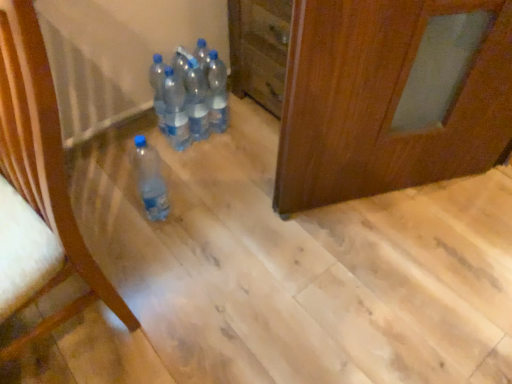
Measure the distance between transparent plastic bottles at center, the 5th bottle when ordered from right to left, and camera.

transparent plastic bottles at center, the 5th bottle when ordered from right to left, is 4.58 feet from camera.

Identify the location of transparent plastic bottles at center, the 5th bottle when ordered from right to left. point(158,88).

Identify the location of transparent plastic bottles at center, placed as the 5th bottle when sorted from left to right. coord(216,92).

The height and width of the screenshot is (384, 512). Describe the element at coordinates (41, 178) in the screenshot. I see `clear plastic bottle at left` at that location.

The image size is (512, 384). What are the coordinates of `translucent plastic bottle at lower left, marked as the 2th bottle in a left-to-right arrangement` in the screenshot? It's located at (150, 180).

Image resolution: width=512 pixels, height=384 pixels. Describe the element at coordinates (196, 101) in the screenshot. I see `translucent plastic bottles at center, placed as the fourth bottle when sorted from left to right` at that location.

I want to click on transparent plastic bottles at center, which appears as the 1th bottle when viewed from the left, so click(x=158, y=88).

Considering the relative sizes of translucent plastic bottle at lower left, acting as the 4th bottle starting from the right, and clear plastic bottle at left in the image provided, is translucent plastic bottle at lower left, acting as the 4th bottle starting from the right, shorter than clear plastic bottle at left?

Yes, translucent plastic bottle at lower left, acting as the 4th bottle starting from the right, is shorter than clear plastic bottle at left.

From a real-world perspective, who is located higher, translucent plastic bottle at lower left, acting as the 4th bottle starting from the right, or clear plastic bottle at left?

From a 3D spatial view, clear plastic bottle at left is above.

Is translucent plastic bottle at lower left, acting as the 4th bottle starting from the right, facing away from clear plastic bottle at left?

No, clear plastic bottle at left is not at the back of translucent plastic bottle at lower left, acting as the 4th bottle starting from the right.

Find the location of a particular element. furniture to the left of translucent plastic bottle at lower left, acting as the 4th bottle starting from the right is located at coordinates (41, 178).

Is translucent plastic bottle at lower left, acting as the 4th bottle starting from the right, smaller than transparent plastic bottles at center, the 3th bottle in the right-to-left sequence?

No, translucent plastic bottle at lower left, acting as the 4th bottle starting from the right, is not smaller than transparent plastic bottles at center, the 3th bottle in the right-to-left sequence.

Is translucent plastic bottle at lower left, marked as the 2th bottle in a left-to-right arrangement, to the left of transparent plastic bottles at center, the third bottle positioned from the left, from the viewer's perspective?

Correct, you'll find translucent plastic bottle at lower left, marked as the 2th bottle in a left-to-right arrangement, to the left of transparent plastic bottles at center, the third bottle positioned from the left.

From a real-world perspective, is translucent plastic bottle at lower left, marked as the 2th bottle in a left-to-right arrangement, below transparent plastic bottles at center, the 3th bottle in the right-to-left sequence?

Correct, in the physical world, translucent plastic bottle at lower left, marked as the 2th bottle in a left-to-right arrangement, is lower than transparent plastic bottles at center, the 3th bottle in the right-to-left sequence.

Between point (153, 202) and point (166, 126), which one is positioned in front?

The point (153, 202) is closer.

In the scene shown: What's the angular difference between translucent plastic bottle at lower left, marked as the 2th bottle in a left-to-right arrangement, and transparent plastic bottles at center, the 5th bottle when ordered from right to left,'s facing directions?

There is a 0.00146-degree angle between the facing directions of translucent plastic bottle at lower left, marked as the 2th bottle in a left-to-right arrangement, and transparent plastic bottles at center, the 5th bottle when ordered from right to left.

Consider the image. Looking at their sizes, would you say translucent plastic bottle at lower left, marked as the 2th bottle in a left-to-right arrangement, is wider or thinner than transparent plastic bottles at center, which appears as the 1th bottle when viewed from the left?

Considering their sizes, translucent plastic bottle at lower left, marked as the 2th bottle in a left-to-right arrangement, looks broader than transparent plastic bottles at center, which appears as the 1th bottle when viewed from the left.

Is translucent plastic bottle at lower left, marked as the 2th bottle in a left-to-right arrangement, to the left or to the right of transparent plastic bottles at center, which appears as the 1th bottle when viewed from the left, in the image?

In the image, translucent plastic bottle at lower left, marked as the 2th bottle in a left-to-right arrangement, appears on the right side of transparent plastic bottles at center, which appears as the 1th bottle when viewed from the left.

From the image's perspective, is translucent plastic bottle at lower left, acting as the 4th bottle starting from the right, below transparent plastic bottles at center, which appears as the 1th bottle when viewed from the left?

Correct, translucent plastic bottle at lower left, acting as the 4th bottle starting from the right, appears lower than transparent plastic bottles at center, which appears as the 1th bottle when viewed from the left, in the image.

Between clear plastic bottle at left and translucent plastic bottles at center, placed as the 2th bottle when sorted from right to left, which one has larger size?

Bigger between the two is clear plastic bottle at left.

Could you measure the distance between clear plastic bottle at left and translucent plastic bottles at center, placed as the 2th bottle when sorted from right to left?

clear plastic bottle at left and translucent plastic bottles at center, placed as the 2th bottle when sorted from right to left, are 31.72 inches apart from each other.

Is clear plastic bottle at left oriented towards translucent plastic bottles at center, placed as the fourth bottle when sorted from left to right?

No, clear plastic bottle at left is not turned towards translucent plastic bottles at center, placed as the fourth bottle when sorted from left to right.

How different are the orientations of clear plastic bottle at left and translucent plastic bottles at center, placed as the fourth bottle when sorted from left to right, in degrees?

There is a 83.1-degree angle between the facing directions of clear plastic bottle at left and translucent plastic bottles at center, placed as the fourth bottle when sorted from left to right.

From a real-world perspective, is translucent plastic bottles at center, placed as the fourth bottle when sorted from left to right, located beneath transparent plastic bottles at center, the third bottle positioned from the left?

No, from a real-world perspective, translucent plastic bottles at center, placed as the fourth bottle when sorted from left to right, is not beneath transparent plastic bottles at center, the third bottle positioned from the left.

Is translucent plastic bottles at center, placed as the fourth bottle when sorted from left to right, next to transparent plastic bottles at center, the third bottle positioned from the left, and touching it?

Yes, translucent plastic bottles at center, placed as the fourth bottle when sorted from left to right, is touching transparent plastic bottles at center, the third bottle positioned from the left.

What's the angular difference between translucent plastic bottles at center, placed as the 2th bottle when sorted from right to left, and transparent plastic bottles at center, the 3th bottle in the right-to-left sequence,'s facing directions?

The facing directions of translucent plastic bottles at center, placed as the 2th bottle when sorted from right to left, and transparent plastic bottles at center, the 3th bottle in the right-to-left sequence, are 0.00225 degrees apart.

Considering the sizes of translucent plastic bottles at center, placed as the 2th bottle when sorted from right to left, and transparent plastic bottles at center, the 3th bottle in the right-to-left sequence, in the image, is translucent plastic bottles at center, placed as the 2th bottle when sorted from right to left, wider or thinner than transparent plastic bottles at center, the 3th bottle in the right-to-left sequence,?

Considering their sizes, translucent plastic bottles at center, placed as the 2th bottle when sorted from right to left, looks slimmer than transparent plastic bottles at center, the 3th bottle in the right-to-left sequence.

The width and height of the screenshot is (512, 384). In order to click on the 4th bottle directly above the translucent plastic bottle at lower left, acting as the 4th bottle starting from the right (from a real-world perspective) in this screenshot , I will do `click(196, 101)`.

From a real-world perspective, which is physically above, translucent plastic bottles at center, placed as the fourth bottle when sorted from left to right, or translucent plastic bottle at lower left, acting as the 4th bottle starting from the right?

translucent plastic bottles at center, placed as the fourth bottle when sorted from left to right, is physically above.

Considering their positions, is translucent plastic bottles at center, placed as the 2th bottle when sorted from right to left, located in front of or behind translucent plastic bottle at lower left, marked as the 2th bottle in a left-to-right arrangement?

Visually, translucent plastic bottles at center, placed as the 2th bottle when sorted from right to left, is located behind translucent plastic bottle at lower left, marked as the 2th bottle in a left-to-right arrangement.

Is clear plastic bottle at left facing away from transparent plastic bottles at center, which appears as the 1th bottle when viewed from the left?

No.

Considering the sizes of objects clear plastic bottle at left and transparent plastic bottles at center, the 5th bottle when ordered from right to left, in the image provided, who is taller, clear plastic bottle at left or transparent plastic bottles at center, the 5th bottle when ordered from right to left,?

clear plastic bottle at left is taller.

From the image's perspective, is clear plastic bottle at left above or below transparent plastic bottles at center, the 5th bottle when ordered from right to left?

Based on their image positions, clear plastic bottle at left is located beneath transparent plastic bottles at center, the 5th bottle when ordered from right to left.

Can we say clear plastic bottle at left lies outside transparent plastic bottles at center, which appears as the 1th bottle when viewed from the left?

Absolutely, clear plastic bottle at left is external to transparent plastic bottles at center, which appears as the 1th bottle when viewed from the left.

This screenshot has width=512, height=384. What are the coordinates of `the 1st bottle above the clear plastic bottle at left (from the image's perspective)` in the screenshot? It's located at (150, 180).

Which bottle is the 1st one when counting from the left side of the transparent plastic bottles at center, the 3th bottle in the right-to-left sequence? Please provide its 2D coordinates.

[(150, 180)]

When comparing their distances from translucent plastic bottle at lower left, marked as the 2th bottle in a left-to-right arrangement, does translucent plastic bottles at center, placed as the fourth bottle when sorted from left to right, or transparent plastic bottles at center, the first bottle positioned from the right, seem closer?

translucent plastic bottles at center, placed as the fourth bottle when sorted from left to right, is positioned closer to the anchor translucent plastic bottle at lower left, marked as the 2th bottle in a left-to-right arrangement.

Looking at the image, which one is located further to clear plastic bottle at left, transparent plastic bottles at center, the third bottle positioned from the left, or transparent plastic bottles at center, which appears as the 1th bottle when viewed from the left?

transparent plastic bottles at center, which appears as the 1th bottle when viewed from the left, is positioned further to the anchor clear plastic bottle at left.

From the image, which object appears to be farther from translucent plastic bottle at lower left, marked as the 2th bottle in a left-to-right arrangement, transparent plastic bottles at center, which appears as the 1th bottle when viewed from the left, or translucent plastic bottles at center, placed as the 2th bottle when sorted from right to left?

translucent plastic bottles at center, placed as the 2th bottle when sorted from right to left.

Which object lies further to the anchor point transparent plastic bottles at center, the third bottle positioned from the left, clear plastic bottle at left or transparent plastic bottles at center, which appears as the 1th bottle when viewed from the left?

clear plastic bottle at left.

In the scene shown: Looking at the image, which one is located further to clear plastic bottle at left, transparent plastic bottles at center, the third bottle positioned from the left, or translucent plastic bottles at center, placed as the fourth bottle when sorted from left to right?

Based on the image, translucent plastic bottles at center, placed as the fourth bottle when sorted from left to right, appears to be further to clear plastic bottle at left.

Estimate the real-world distances between objects in this image. Which object is closer to translucent plastic bottles at center, placed as the fourth bottle when sorted from left to right, clear plastic bottle at left or transparent plastic bottles at center, placed as the 5th bottle when sorted from left to right?

Among the two, transparent plastic bottles at center, placed as the 5th bottle when sorted from left to right, is located nearer to translucent plastic bottles at center, placed as the fourth bottle when sorted from left to right.

Looking at the image, which one is located further to transparent plastic bottles at center, the third bottle positioned from the left, translucent plastic bottles at center, placed as the fourth bottle when sorted from left to right, or translucent plastic bottle at lower left, marked as the 2th bottle in a left-to-right arrangement?

translucent plastic bottle at lower left, marked as the 2th bottle in a left-to-right arrangement, lies further to transparent plastic bottles at center, the third bottle positioned from the left, than the other object.

From the image, which object appears to be nearer to translucent plastic bottles at center, placed as the 2th bottle when sorted from right to left, translucent plastic bottle at lower left, marked as the 2th bottle in a left-to-right arrangement, or clear plastic bottle at left?

translucent plastic bottle at lower left, marked as the 2th bottle in a left-to-right arrangement, is positioned closer to the anchor translucent plastic bottles at center, placed as the 2th bottle when sorted from right to left.

In order to click on bottle between clear plastic bottle at left and transparent plastic bottles at center, the third bottle positioned from the left, from front to back in this screenshot , I will do `click(150, 180)`.

This screenshot has height=384, width=512. I want to click on bottle between translucent plastic bottles at center, placed as the fourth bottle when sorted from left to right, and translucent plastic bottle at lower left, acting as the 4th bottle starting from the right, vertically, so click(x=175, y=111).

Find the location of a particular element. This screenshot has height=384, width=512. bottle located between transparent plastic bottles at center, the 3th bottle in the right-to-left sequence, and transparent plastic bottles at center, the first bottle positioned from the right, in the left-right direction is located at coordinates coord(196,101).